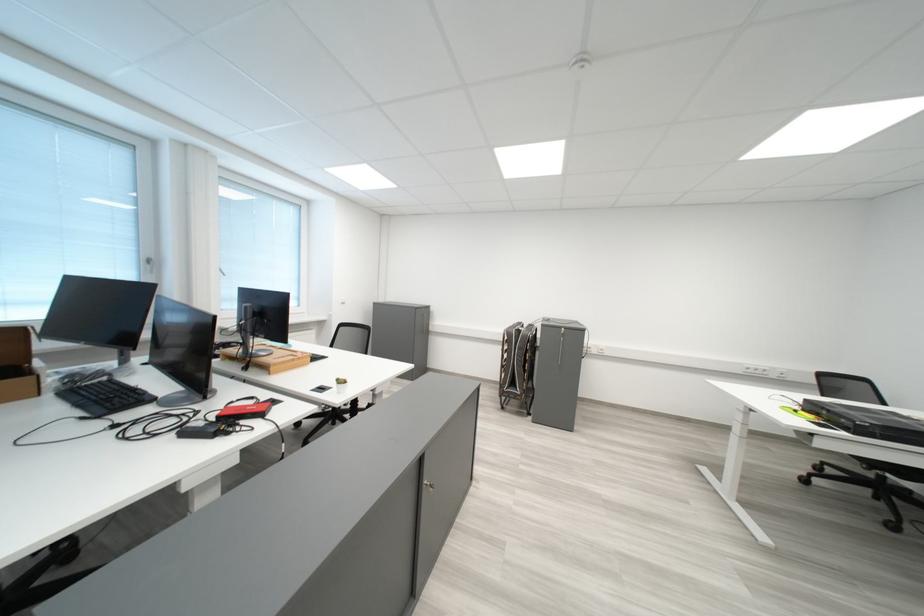
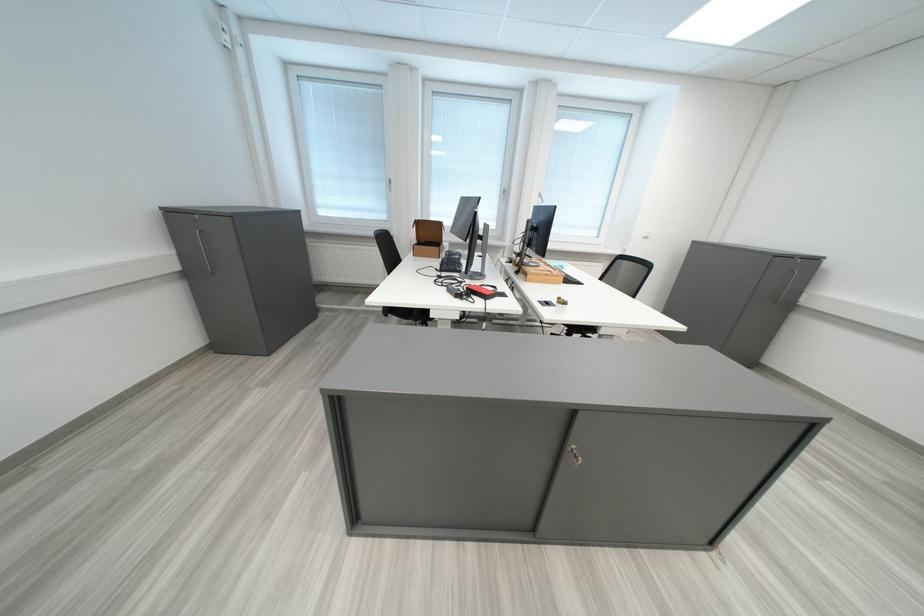
Find the pixel in the second image that matches pixel 277 369 in the first image.

(539, 276)